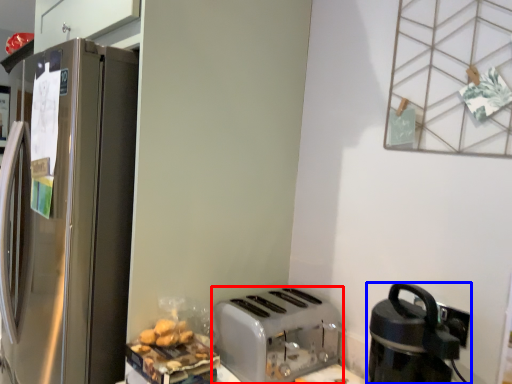
Question: Among these objects, which one is nearest to the camera, toaster (highlighted by a red box) or kitchen appliance (highlighted by a blue box)?

Choices:
 (A) toaster
 (B) kitchen appliance

Answer: (B)